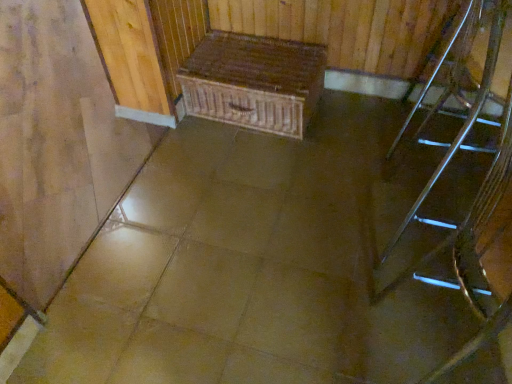
Find the location of a particular element. The image size is (512, 384). vacant space in between metallic silver stairs at right and wooden chest at center is located at coordinates (327, 166).